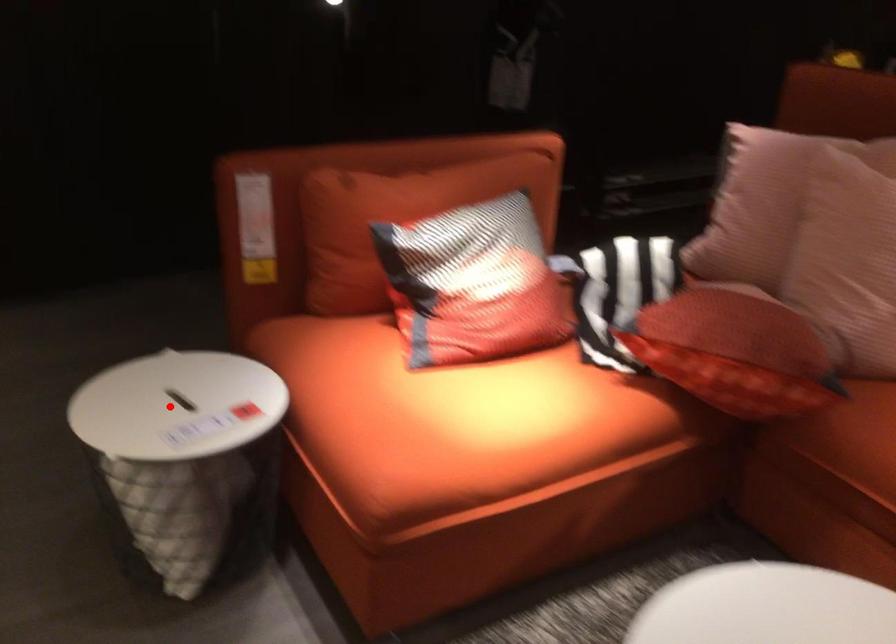
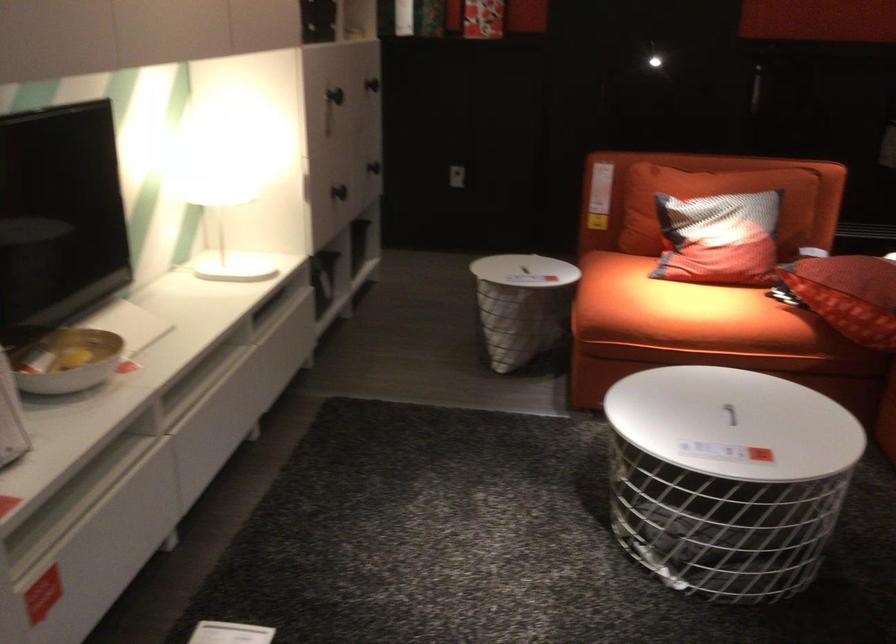
Where in the second image is the point corresponding to the highlighted location from the first image?

(522, 270)